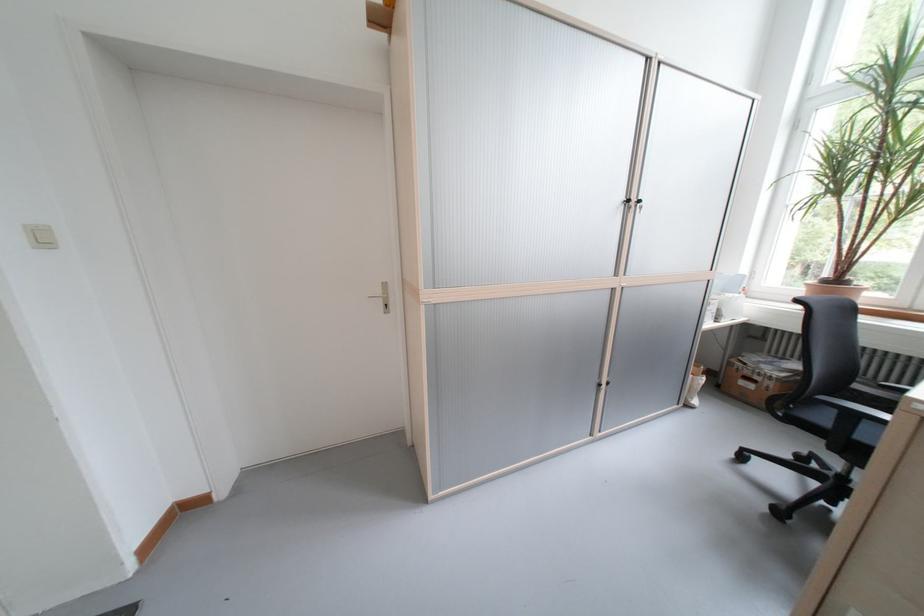
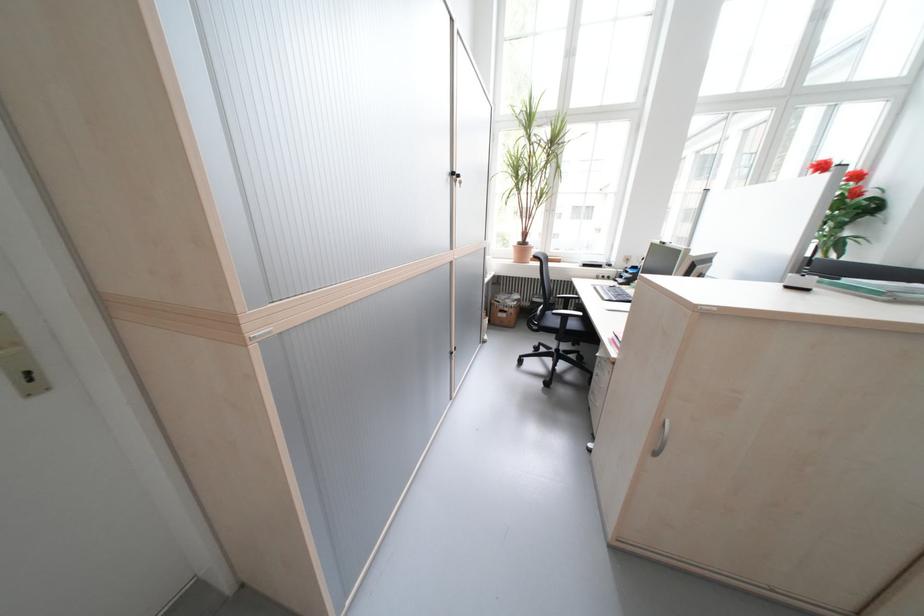
Locate, in the second image, the point that corresponds to (x=862, y=418) in the first image.

(575, 318)